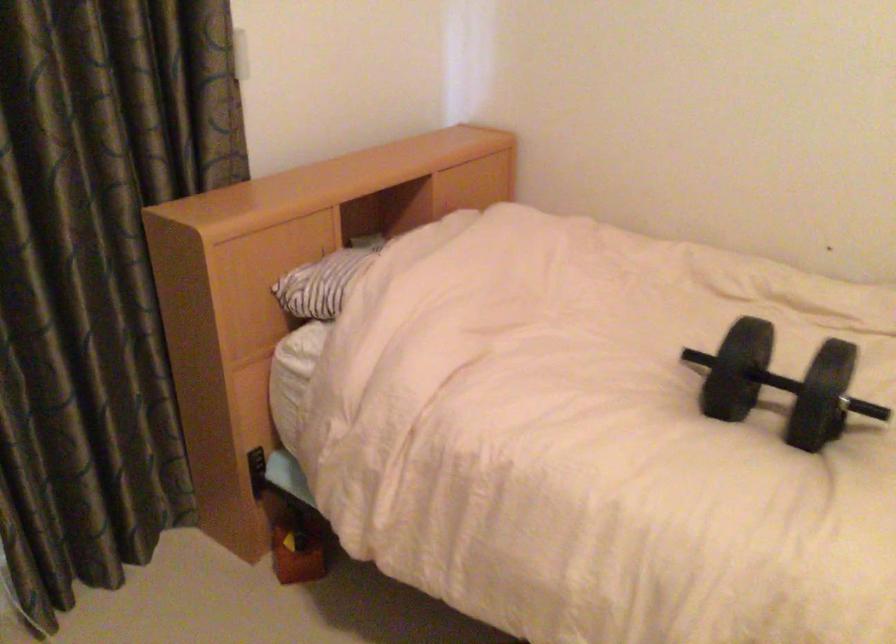
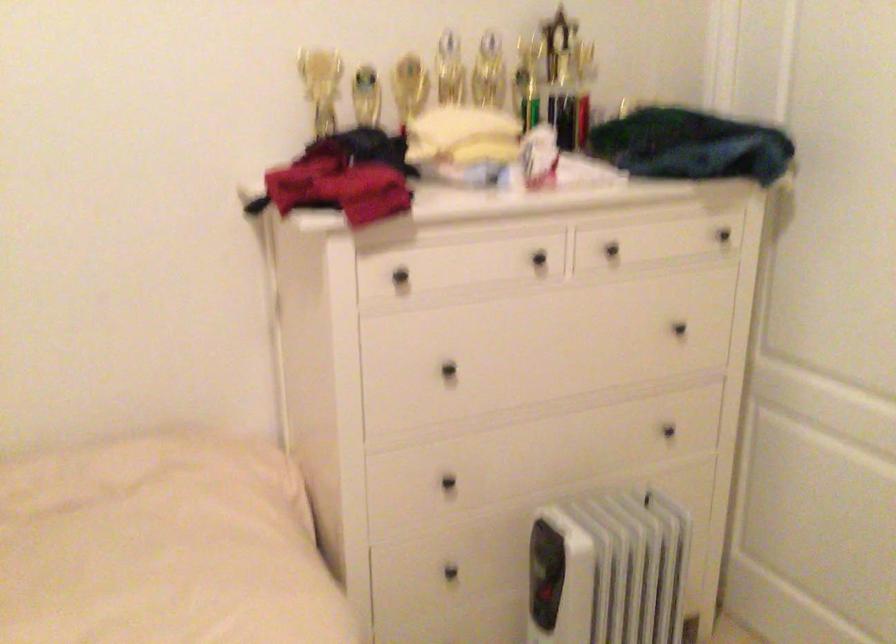
Question: Based on the continuous images, in which direction is the camera rotating? Reply with the corresponding letter.

Choices:
 (A) Left
 (B) Right
 (C) Up
 (D) Down

Answer: (B)